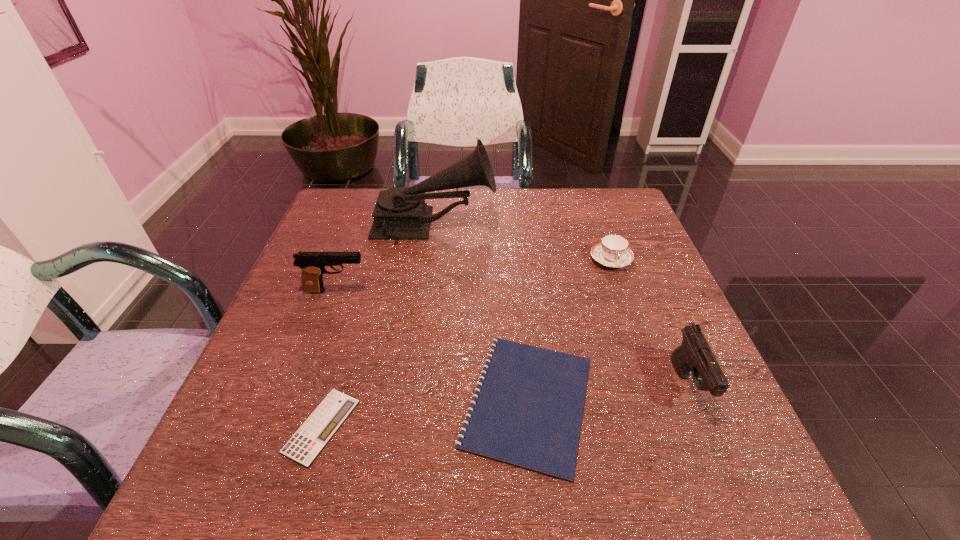
Locate an element on the screen. This screenshot has height=540, width=960. object that is the third closest to the fifth tallest object is located at coordinates (612, 251).

The height and width of the screenshot is (540, 960). In order to click on free point that satisfies the following two spatial constraints: 1. at the barrel of the farther pistol; 2. on the right side of the second shortest object in this screenshot , I will do `click(296, 402)`.

Image resolution: width=960 pixels, height=540 pixels. Identify the location of free space in the image that satisfies the following two spatial constraints: 1. at the barrel of the calculator; 2. on the left side of the third farthest object. (287, 426).